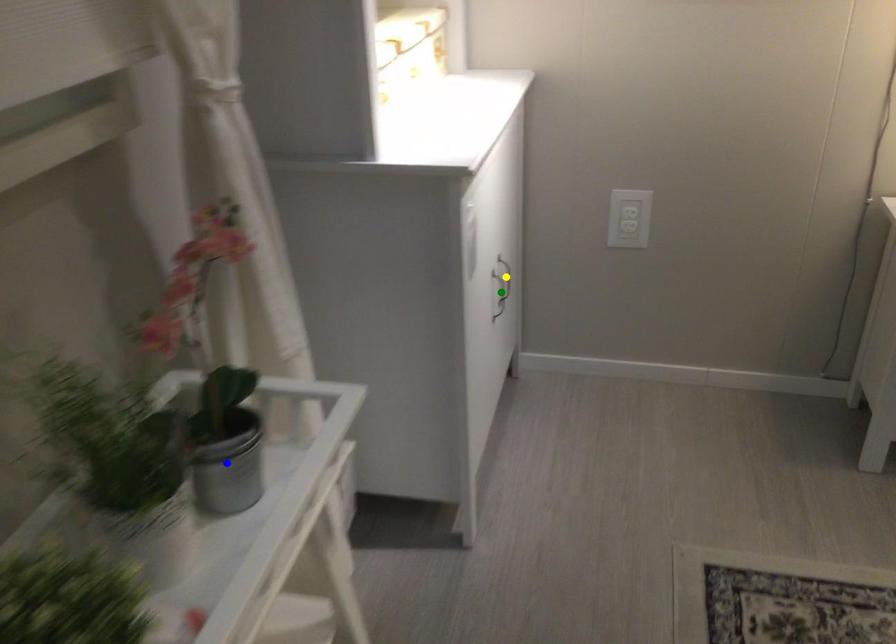
Order these from nearest to farthest:
green point, yellow point, blue point

yellow point
green point
blue point